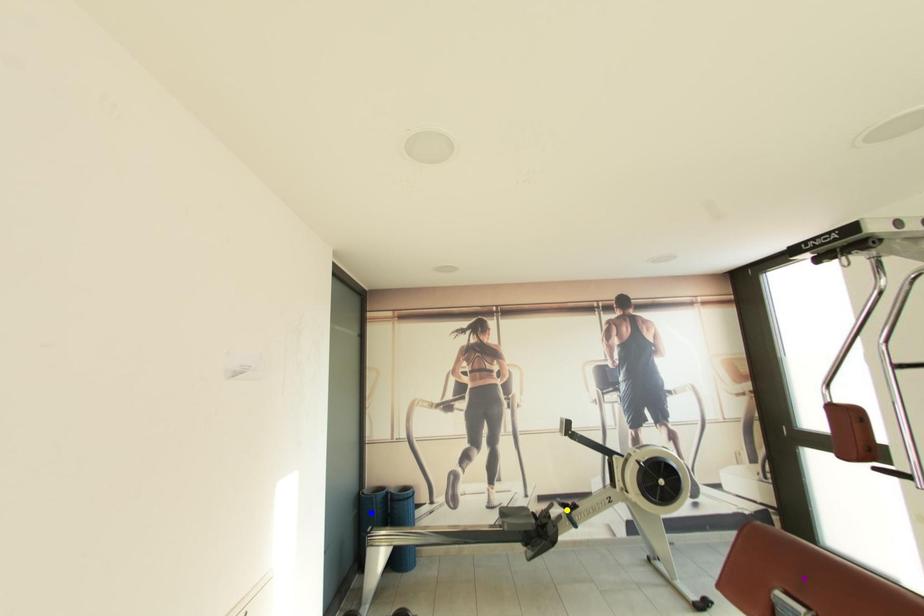
Order these from farthest to nearest:
- yellow point
- purple point
- blue point

blue point → yellow point → purple point